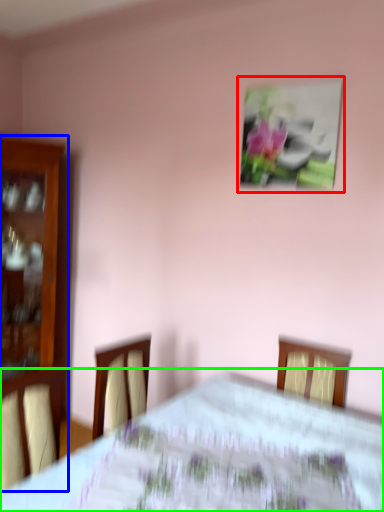
Question: Estimate the real-world distances between objects in this image. Which object is farther from picture frame (highlighted by a red box), furniture (highlighted by a blue box) or bed (highlighted by a green box)?

Choices:
 (A) furniture
 (B) bed

Answer: (A)